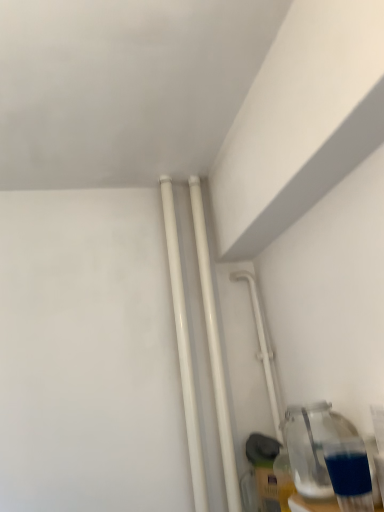
Question: From their relative heights in the image, would you say white glossy pipe at center-right is taller or shorter than transparent glass bottle at lower right?

Choices:
 (A) tall
 (B) short

Answer: (A)

Question: From a real-world perspective, is white glossy pipe at center-right physically located above or below transparent glass bottle at lower right?

Choices:
 (A) below
 (B) above

Answer: (B)

Question: Considering the real-world distances, which object is closest to the white glossy pipes at center, acting as the first pipe starting from the right?

Choices:
 (A) white glossy pipes at center, acting as the first pipe starting from the left
 (B) white glossy pipe at center-right
 (C) transparent glass bottle at lower right

Answer: (A)

Question: Estimate the real-world distances between objects in this image. Which object is farther from the white glossy pipes at center, which is the second pipe from right to left?

Choices:
 (A) white glossy pipe at center-right
 (B) transparent glass bottle at lower right
 (C) white glossy pipes at center, acting as the first pipe starting from the right

Answer: (B)